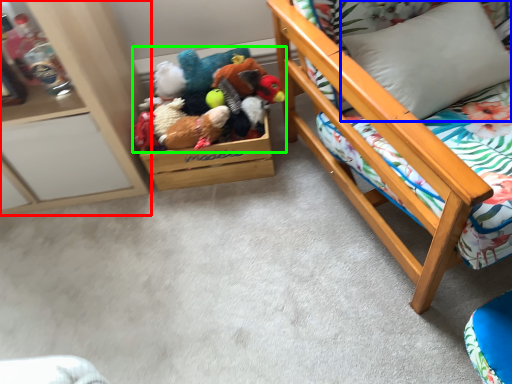
Question: Which is nearer to the furniture (highlighted by a red box)? pillow (highlighted by a blue box) or toy (highlighted by a green box).

Choices:
 (A) pillow
 (B) toy

Answer: (B)